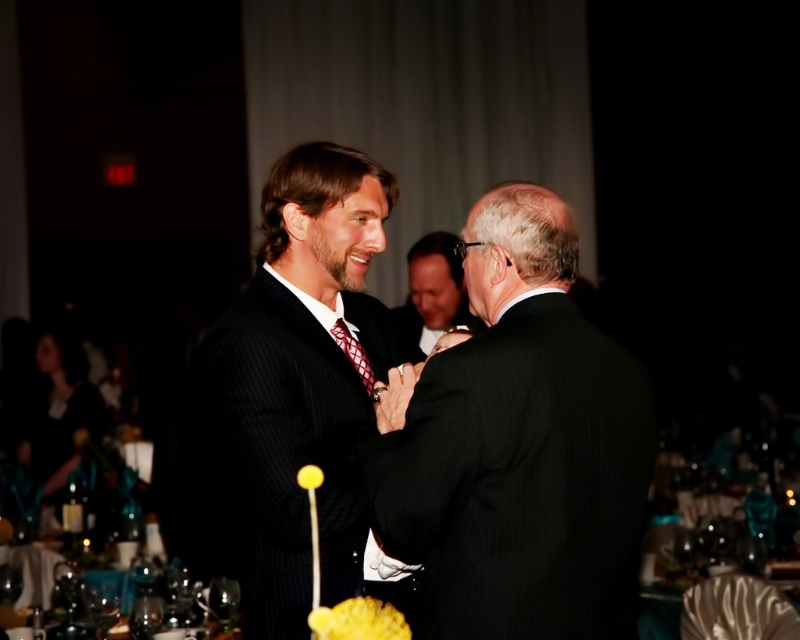
Who is taller, black pinstripe suit at center or smooth black suit at center?

black pinstripe suit at center is taller.

Locate an element on the screen. black pinstripe suit at center is located at coordinates (520, 448).

Does pinstriped suit at center have a greater height compared to silky black dress at lower left?

Yes, pinstriped suit at center is taller than silky black dress at lower left.

Looking at this image, does pinstriped suit at center appear on the left side of silky black dress at lower left?

Incorrect, pinstriped suit at center is not on the left side of silky black dress at lower left.

This screenshot has width=800, height=640. Describe the element at coordinates (288, 400) in the screenshot. I see `pinstriped suit at center` at that location.

At what (x,y) coordinates should I click in order to perform the action: click on pinstriped suit at center. Please return your answer as a coordinate pair (x, y). Image resolution: width=800 pixels, height=640 pixels. Looking at the image, I should click on (288, 400).

Who is positioned more to the left, black pinstripe suit at center or red textured tie at center?

red textured tie at center

Is black pinstripe suit at center smaller than red textured tie at center?

Actually, black pinstripe suit at center might be larger than red textured tie at center.

Locate an element on the screen. The height and width of the screenshot is (640, 800). black pinstripe suit at center is located at coordinates (520, 448).

Where is `black pinstripe suit at center`? black pinstripe suit at center is located at coordinates (520, 448).